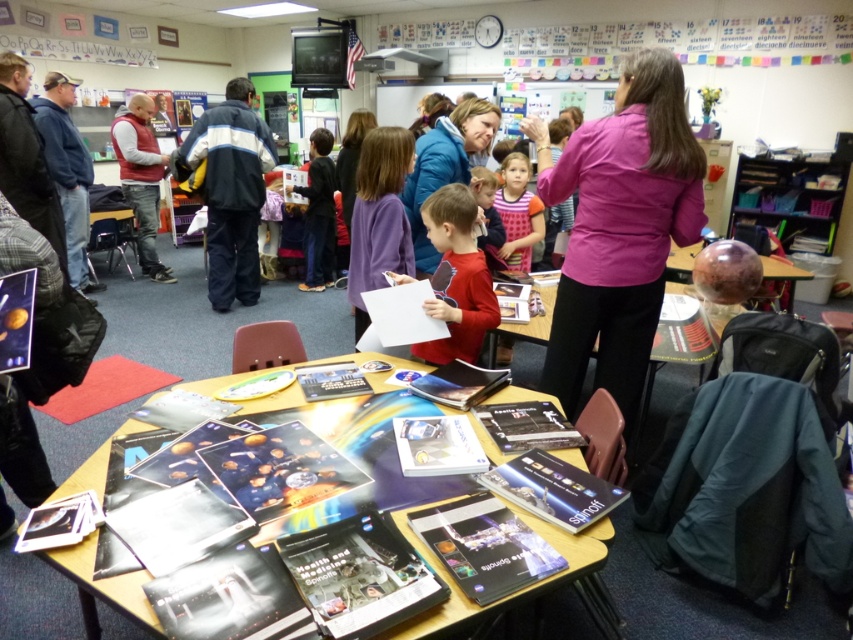
What are the coordinates of the shiny plastic table at center?

The shiny plastic table at center is located at coordinates point (518, 589).

You are a student entering the classroom and see both the shiny plastic table at center and the wooden table at center. Which table is closer to the left side of the room?

The shiny plastic table at center is closer to the left side of the room since it is positioned to the left of the wooden table at center.

You are standing at the entrance of the classroom and want to reach the wooden table at center. Which direction should you move to get there?

Since the wooden table at center is located at point coordinates, you should move towards the center of the room to reach it.